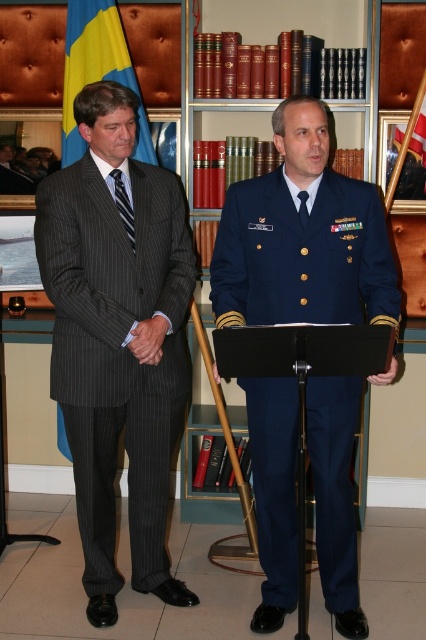
You are a photographer setting up for a group photo. You need to ensure everyone can fit in the frame. The camera you are using has a maximum coverage width of 1.8 meters. Given the current positions of the navy blue uniform at center and the matte black suit at left, will both individuals fit within the camera frame?

The distance between the navy blue uniform at center and the matte black suit at left is 2.00 meters, which exceeds the camera frame width of 1.8 meters. Therefore, both individuals will not fit within the camera frame.

You are an interior designer assessing the layout of this formal room. You notice the yellow fabric flag at upper left and the matte black suit at left. Which object occupies more space in the visual composition?

The yellow fabric flag at upper left is larger in size than the matte black suit at left, so it occupies more space in the visual composition.